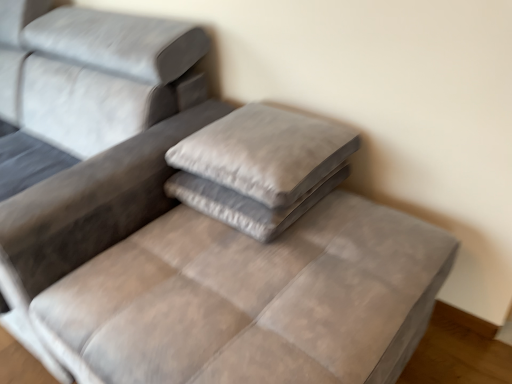
Question: Does velvet gray mattress at center turn towards suede gray pillow at center, which is counted as the first pillow, starting from the top?

Choices:
 (A) yes
 (B) no

Answer: (B)

Question: Does velvet gray mattress at center have a greater width compared to suede gray pillow at center, placed as the second pillow when sorted from bottom to top?

Choices:
 (A) no
 (B) yes

Answer: (B)

Question: From the image's perspective, is velvet gray mattress at center located beneath suede gray pillow at center, placed as the second pillow when sorted from bottom to top?

Choices:
 (A) no
 (B) yes

Answer: (B)

Question: From a real-world perspective, is velvet gray mattress at center below suede gray pillow at center, which is counted as the first pillow, starting from the top?

Choices:
 (A) yes
 (B) no

Answer: (A)

Question: Is velvet gray mattress at center further to camera compared to suede gray pillow at center, placed as the second pillow when sorted from bottom to top?

Choices:
 (A) no
 (B) yes

Answer: (A)

Question: Is point pyautogui.click(x=181, y=311) positioned closer to the camera than point pyautogui.click(x=285, y=125)?

Choices:
 (A) closer
 (B) farther

Answer: (A)

Question: From a real-world perspective, is velvet gray mattress at center above or below suede gray pillow at center, which is counted as the first pillow, starting from the top?

Choices:
 (A) below
 (B) above

Answer: (A)

Question: Which is correct: velvet gray mattress at center is inside suede gray pillow at center, which is counted as the first pillow, starting from the top, or outside of it?

Choices:
 (A) outside
 (B) inside

Answer: (A)

Question: Is velvet gray mattress at center in front of or behind suede gray pillow at center, which is counted as the first pillow, starting from the top, in the image?

Choices:
 (A) front
 (B) behind

Answer: (A)

Question: From the image's perspective, is velvet gray pillow at center, the 2th pillow viewed from the top, positioned above or below suede gray pillow at center, placed as the second pillow when sorted from bottom to top?

Choices:
 (A) below
 (B) above

Answer: (A)

Question: Do you think velvet gray pillow at center, the 2th pillow viewed from the top, is within suede gray pillow at center, which is counted as the first pillow, starting from the top, or outside of it?

Choices:
 (A) outside
 (B) inside

Answer: (A)

Question: Considering the positions of velvet gray pillow at center, the 2th pillow viewed from the top, and suede gray pillow at center, placed as the second pillow when sorted from bottom to top, in the image, is velvet gray pillow at center, the 2th pillow viewed from the top, taller or shorter than suede gray pillow at center, placed as the second pillow when sorted from bottom to top,?

Choices:
 (A) tall
 (B) short

Answer: (B)

Question: Does point (168, 195) appear closer or farther from the camera than point (259, 172)?

Choices:
 (A) farther
 (B) closer

Answer: (A)

Question: Is velvet gray pillow at center, which appears as the first pillow when ordered from the bottom, in front of or behind velvet gray mattress at center in the image?

Choices:
 (A) behind
 (B) front

Answer: (A)

Question: In the image, is velvet gray pillow at center, which appears as the first pillow when ordered from the bottom, on the left side or the right side of velvet gray mattress at center?

Choices:
 (A) right
 (B) left

Answer: (A)